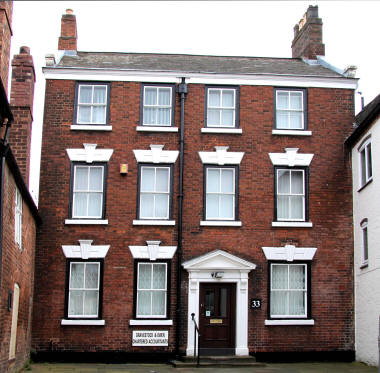
The width and height of the screenshot is (380, 373). Find the location of `door`. door is located at coordinates (214, 336).